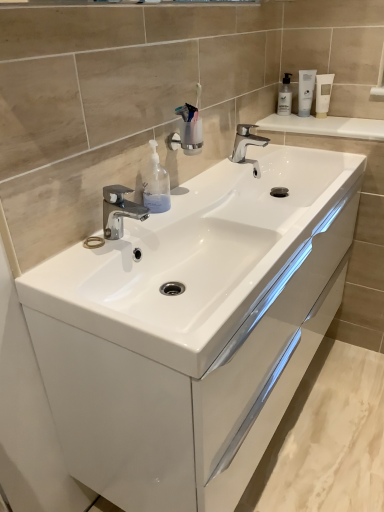
Image resolution: width=384 pixels, height=512 pixels. Identify the location of vacant area that is in front of polished chrome tap at center, the second tap when ordered from top to bottom. pyautogui.click(x=87, y=273).